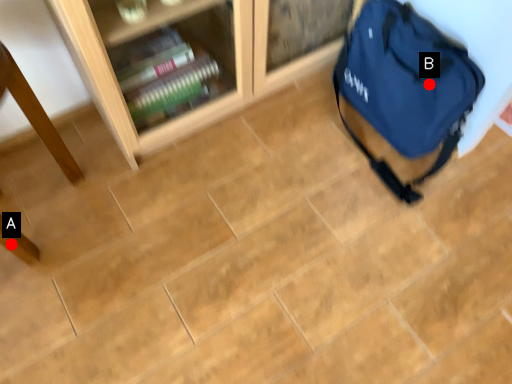
Question: Two points are circled on the image, labeled by A and B beside each circle. Which point is farther to the camera?

Choices:
 (A) A is further
 (B) B is further

Answer: (B)